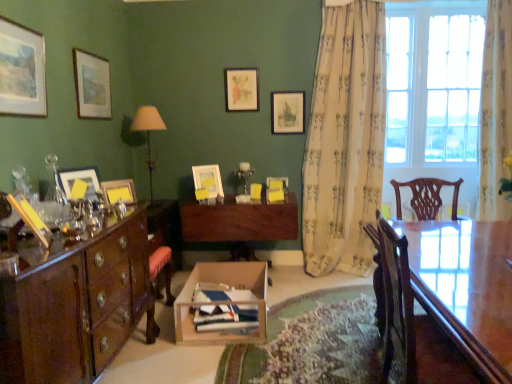
Question: Is polished wood cabinet at left further to the viewer compared to matte white picture frame at left, the seventh picture frame when ordered from back to front?

Choices:
 (A) no
 (B) yes

Answer: (A)

Question: Could you tell me if polished wood cabinet at left is facing matte white picture frame at left, marked as the 6th picture frame in a right-to-left arrangement?

Choices:
 (A) yes
 (B) no

Answer: (B)

Question: From a real-world perspective, is polished wood cabinet at left over matte white picture frame at left, which is counted as the 2th picture frame, starting from the front?

Choices:
 (A) no
 (B) yes

Answer: (A)

Question: Can you confirm if polished wood cabinet at left is smaller than matte white picture frame at left, marked as the 6th picture frame in a right-to-left arrangement?

Choices:
 (A) no
 (B) yes

Answer: (A)

Question: Are polished wood cabinet at left and matte white picture frame at left, which is the third picture frame from left to right, far apart?

Choices:
 (A) no
 (B) yes

Answer: (A)

Question: Considering the positions of glossy wood table at right and matte pink picture frame at upper center, the seventh picture frame in the front-to-back sequence, in the image, is glossy wood table at right taller or shorter than matte pink picture frame at upper center, the seventh picture frame in the front-to-back sequence,?

Choices:
 (A) tall
 (B) short

Answer: (A)

Question: Is point (467, 266) closer or farther from the camera than point (224, 74)?

Choices:
 (A) closer
 (B) farther

Answer: (A)

Question: Considering the positions of glossy wood table at right and matte pink picture frame at upper center, the third picture frame in the right-to-left sequence, in the image, is glossy wood table at right bigger or smaller than matte pink picture frame at upper center, the third picture frame in the right-to-left sequence,?

Choices:
 (A) big
 (B) small

Answer: (A)

Question: Relative to matte pink picture frame at upper center, the seventh picture frame in the front-to-back sequence, is glossy wood table at right in front or behind?

Choices:
 (A) behind
 (B) front

Answer: (B)

Question: Considering the positions of point (496, 195) and point (445, 278), is point (496, 195) closer or farther from the camera than point (445, 278)?

Choices:
 (A) farther
 (B) closer

Answer: (A)

Question: Considering their positions, is floral fabric curtain at right, which appears as the second curtain when viewed from the left, located in front of or behind glossy wood table at right?

Choices:
 (A) front
 (B) behind

Answer: (B)

Question: Based on their positions, is floral fabric curtain at right, which appears as the first curtain when viewed from the right, located to the left or right of glossy wood table at right?

Choices:
 (A) left
 (B) right

Answer: (B)

Question: Considering the positions of floral fabric curtain at right, which appears as the second curtain when viewed from the left, and glossy wood table at right in the image, is floral fabric curtain at right, which appears as the second curtain when viewed from the left, bigger or smaller than glossy wood table at right?

Choices:
 (A) small
 (B) big

Answer: (A)

Question: Looking at their shapes, would you say matte pink picture frame at upper center, the third picture frame in the right-to-left sequence, is wider or thinner than matte white picture frame at center, which is the second picture frame from right to left?

Choices:
 (A) wide
 (B) thin

Answer: (B)

Question: Relative to matte white picture frame at center, arranged as the 7th picture frame when viewed from the left, is matte pink picture frame at upper center, the 2th picture frame in the back-to-front sequence, in front or behind?

Choices:
 (A) behind
 (B) front

Answer: (A)